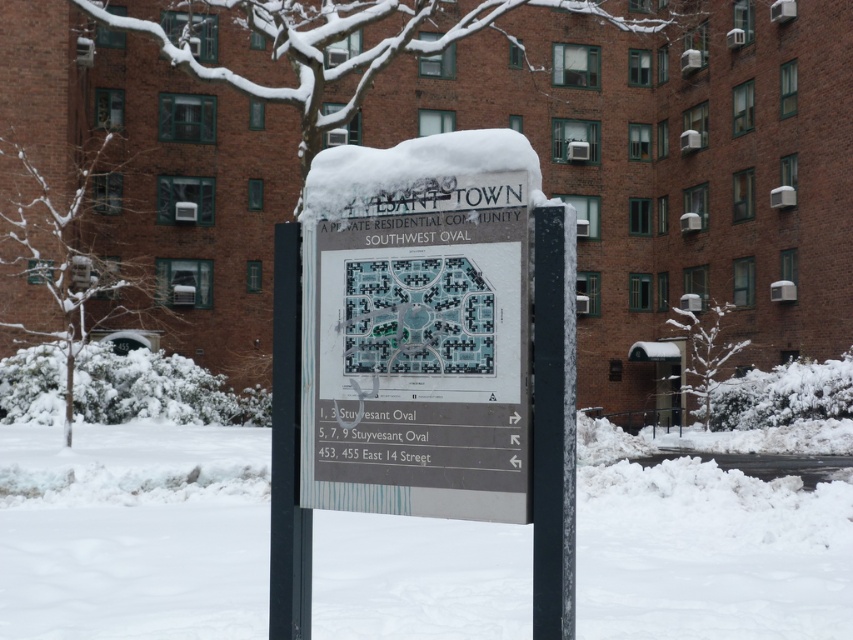
You are standing in front of the signpost in the snowy scene. You need to place a small decoration on the black plastic pole at center so that it won t be covered by the white plastic sign at center. Where should you place the decoration?

The black plastic pole at center is positioned under the white plastic sign at center, so placing the decoration below the sign would ensure it remains uncovered.

You are a delivery person trying to navigate through the snow. You see the black metal pole at center and the white plastic sign at center. Which object should you avoid hitting with your delivery cart to prevent damage?

You should avoid hitting the black metal pole at center because it might be wider than the white plastic sign at center, making it more likely to cause damage if collided with.

You are standing in front of the signpost in the snowy scene. You want to take a photo of the white plastic sign at center without the black metal pole at center blocking the view. Is there a way to position yourself to do this?

The black metal pole at center is in front of the white plastic sign at center, so you would need to move to a position where the pole is no longer between you and the sign. This could involve moving to the side or behind the pole to capture the sign without obstruction.